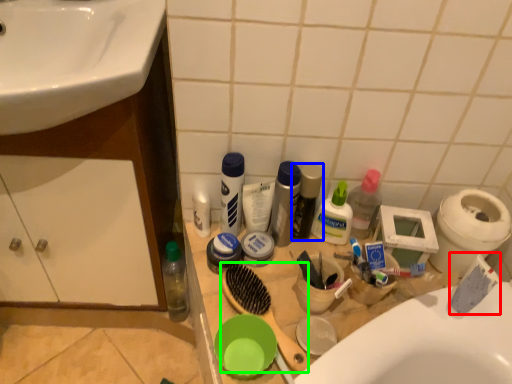
Question: Based on their relative distances, which object is farther from toothpaste (highlighted by a red box)? Choose from toiletry (highlighted by a blue box) and brush (highlighted by a green box).

Choices:
 (A) toiletry
 (B) brush

Answer: (B)